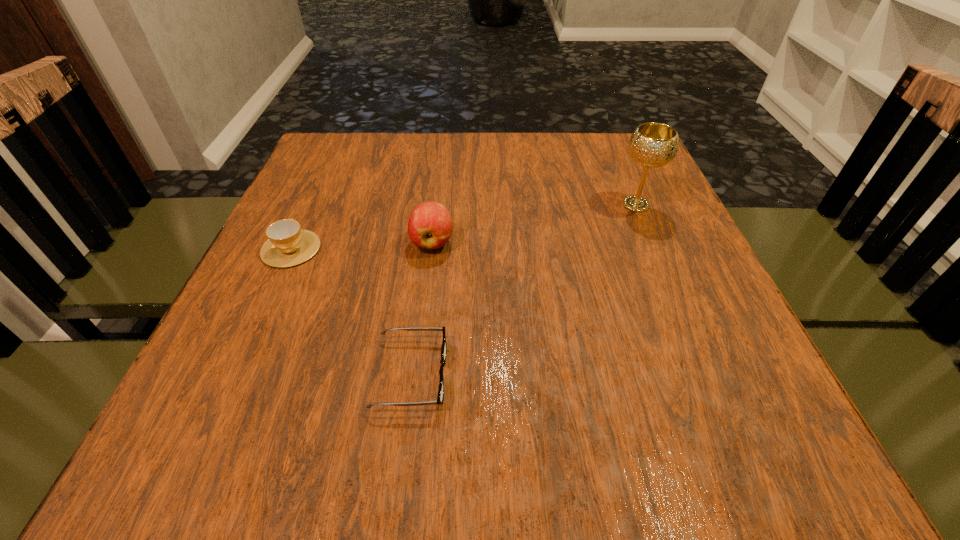
This screenshot has width=960, height=540. In the image, there is a desktop. What are the coordinates of `vacant space at the far left corner` in the screenshot? It's located at (344, 179).

In the image, there is a desktop. Identify the location of free region at the far right corner. (606, 163).

The height and width of the screenshot is (540, 960). I want to click on vacant point located between the spectacles and the second shortest object, so click(x=351, y=312).

Identify the location of empty space that is in between the nearest object and the third tallest object. (351, 312).

Find the location of `free space between the chalice and the second tallest object`. free space between the chalice and the second tallest object is located at coordinates (534, 223).

Where is `vacant point located between the rightmost object and the nearest object`? The image size is (960, 540). vacant point located between the rightmost object and the nearest object is located at coordinates (523, 289).

You are a GUI agent. You are given a task and a screenshot of the screen. Output one action in this format:
    pyautogui.click(x=<x>, y=<y>)
    Task: Click on the free space between the third shortest object and the cup
    
    Given the screenshot: What is the action you would take?
    pyautogui.click(x=362, y=246)

Identify the location of unoccupied position between the cup and the nearest object. (351, 312).

You are a GUI agent. You are given a task and a screenshot of the screen. Output one action in this format:
    pyautogui.click(x=<x>, y=<y>)
    Task: Click on the unoccupied area between the nearest object and the leftmost object
    Image resolution: width=960 pixels, height=540 pixels.
    Given the screenshot: What is the action you would take?
    pyautogui.click(x=351, y=312)

Find the location of `free space between the third shortest object and the nearest object`. free space between the third shortest object and the nearest object is located at coordinates (421, 308).